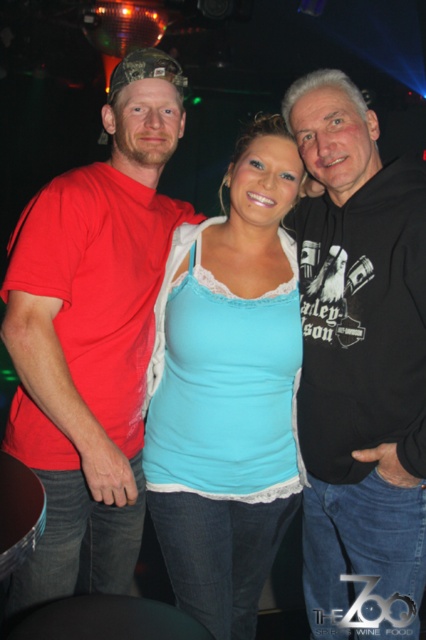
You are organizing a charity clothing drive and need to categorize the items based on their width. You have two items to sort today. The first is the black hoodie at right and the second is the light blue fabric tank top at center. Which item is wider?

The light blue fabric tank top at center is wider than the black hoodie at right.